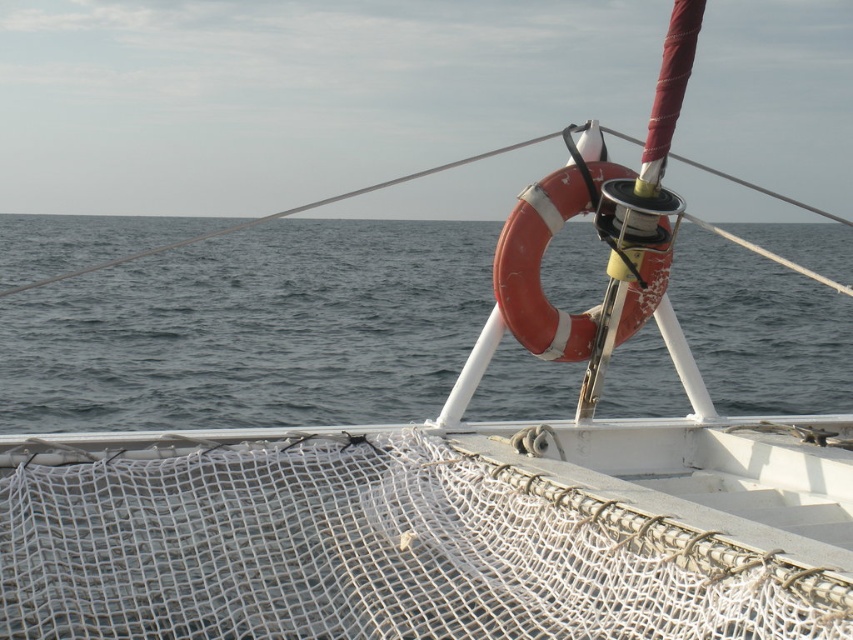
Question: In this image, where is white mesh net at center located relative to gray matte water at center?

Choices:
 (A) left
 (B) right

Answer: (B)

Question: Is white mesh net at center behind gray matte water at center?

Choices:
 (A) no
 (B) yes

Answer: (A)

Question: Is white mesh net at center below gray matte water at center?

Choices:
 (A) yes
 (B) no

Answer: (A)

Question: Which of the following is the closest to the observer?

Choices:
 (A) (410, 280)
 (B) (189, 486)

Answer: (B)